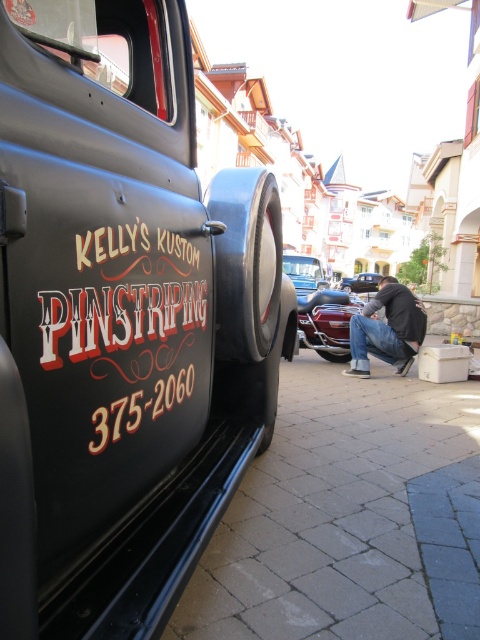
Question: Is black pinstriping at center further to camera compared to jeans at center?

Choices:
 (A) no
 (B) yes

Answer: (A)

Question: Can you confirm if shiny chrome motorcycle at center is thinner than black rubber tire at lower center?

Choices:
 (A) yes
 (B) no

Answer: (B)

Question: Is black pinstriping at center bigger than black rubber tire at lower center?

Choices:
 (A) yes
 (B) no

Answer: (A)

Question: Which object is positioned closest to the black rubber tire at lower center?

Choices:
 (A) shiny chrome motorcycle at center
 (B) jeans at center

Answer: (B)

Question: Which point appears farthest from the camera in this image?

Choices:
 (A) (333, 355)
 (B) (365, 278)
 (C) (108, 381)

Answer: (B)

Question: Considering the real-world distances, which object is closest to the black pinstriping at center?

Choices:
 (A) jeans at center
 (B) black rubber tire at lower center
 (C) shiny chrome motorcycle at center

Answer: (C)